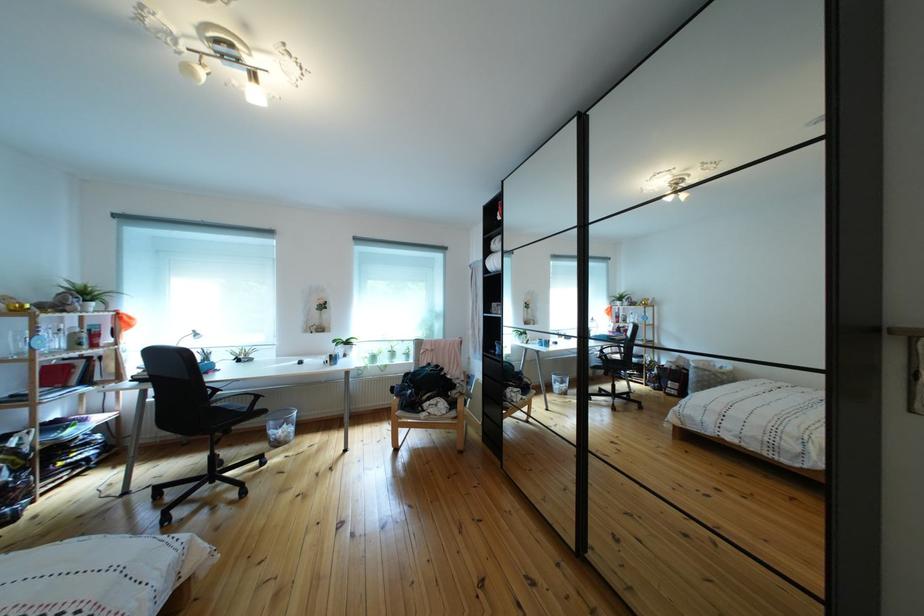
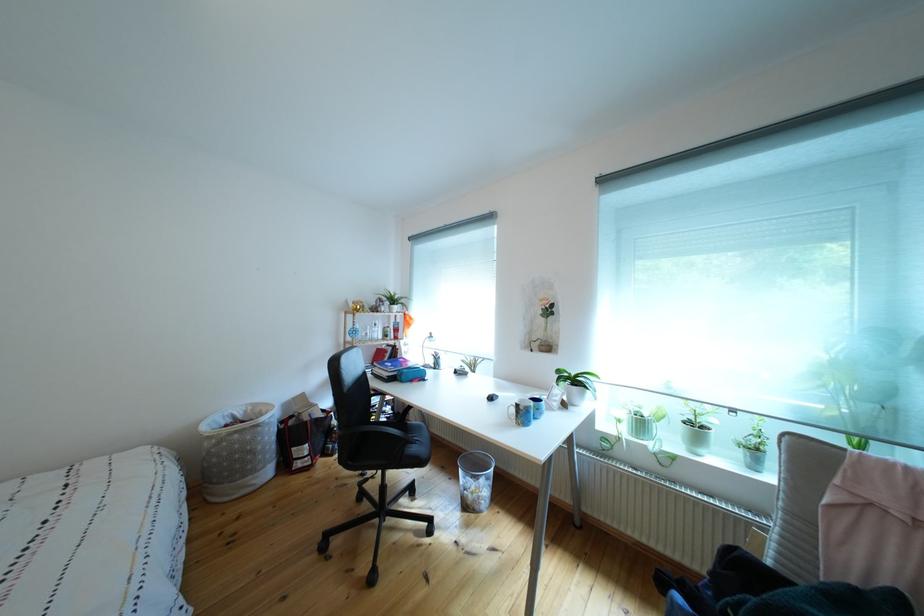
Where in the second image is the point corresponding to (359,349) from the first image?

(588, 387)